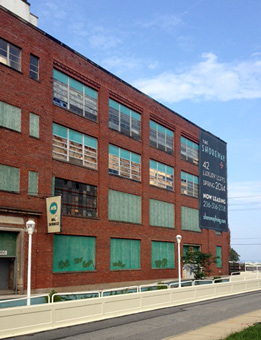
Locate an element on the screen. lights are on inside of these areas is located at coordinates (78, 154), (120, 164), (160, 174), (188, 186), (189, 153).